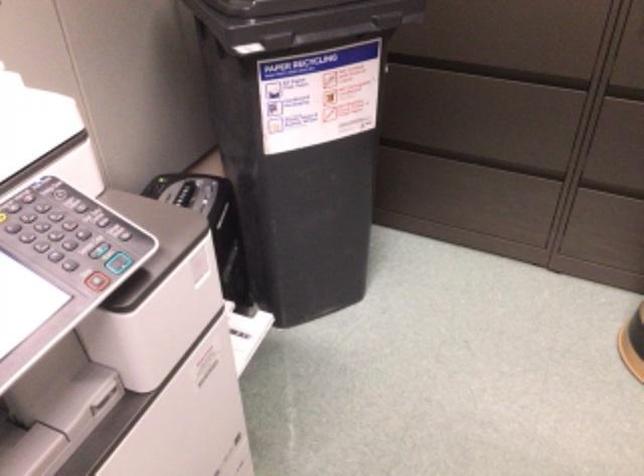
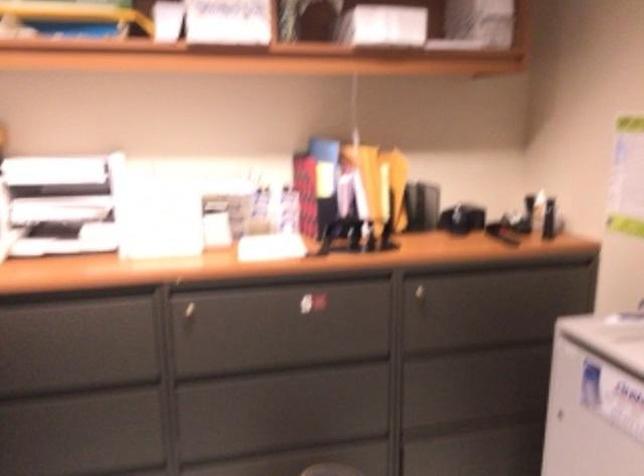
Locate, in the second image, the point that corresponds to point 496,120 in the first image.

(89, 441)